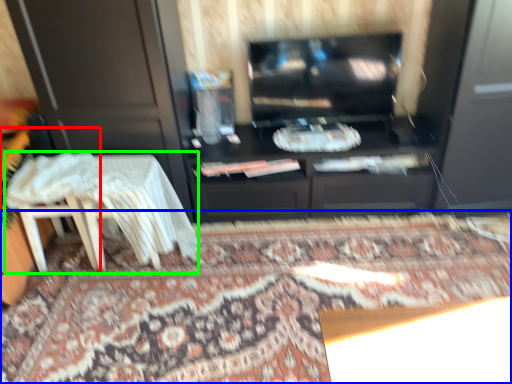
Question: Which object is positioned farthest from chair (highlighted by a red box)? Select from mat (highlighted by a blue box) and table (highlighted by a green box).

Choices:
 (A) mat
 (B) table

Answer: (A)